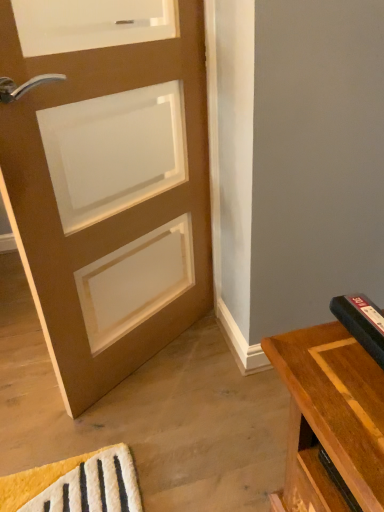
Identify the location of vacant space underneath matte brown door at left (from a real-world perspective). Image resolution: width=384 pixels, height=512 pixels. (159, 353).